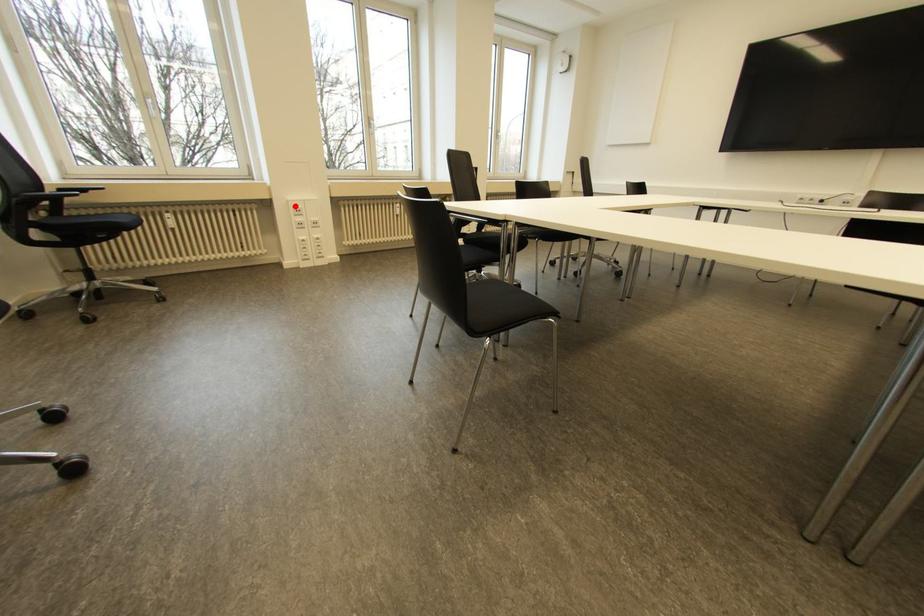
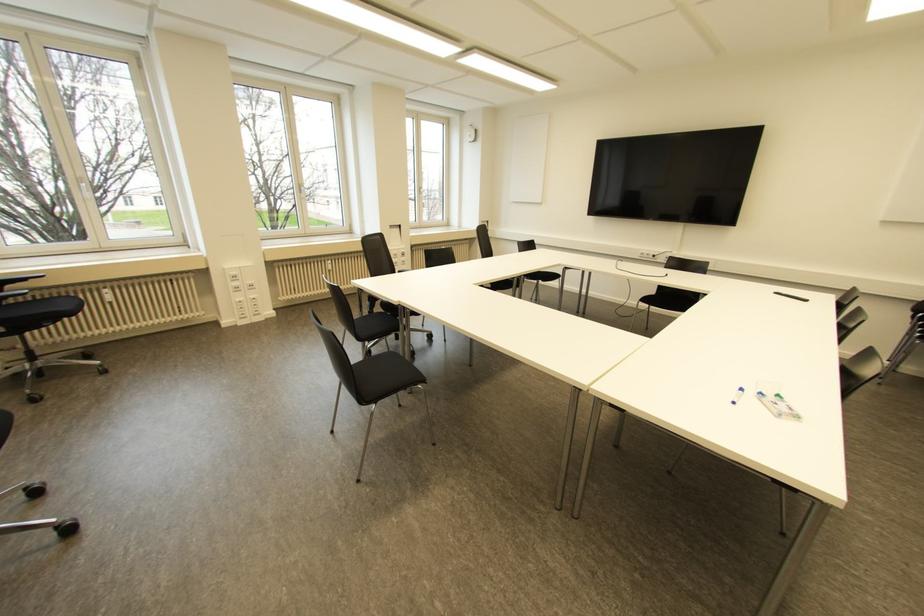
In the second image, find the point that corresponds to the highlighted location in the first image.

(232, 273)